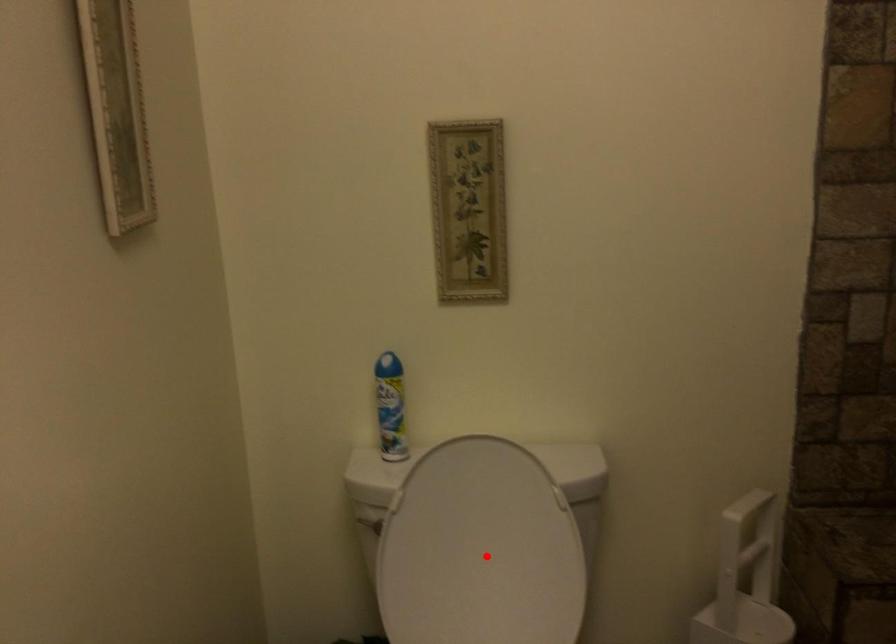
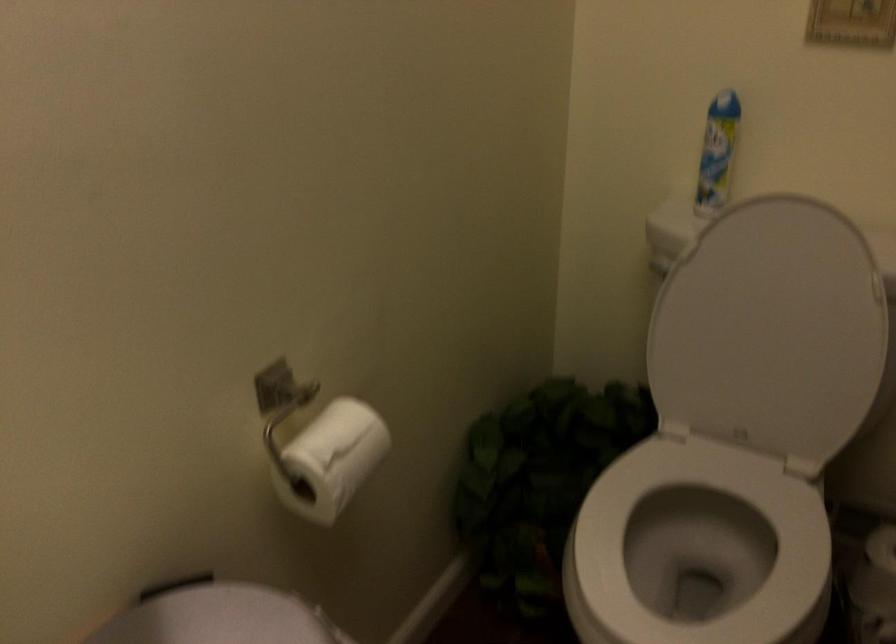
Where in the second image is the point corresponding to the highlighted location from the first image?

(771, 330)